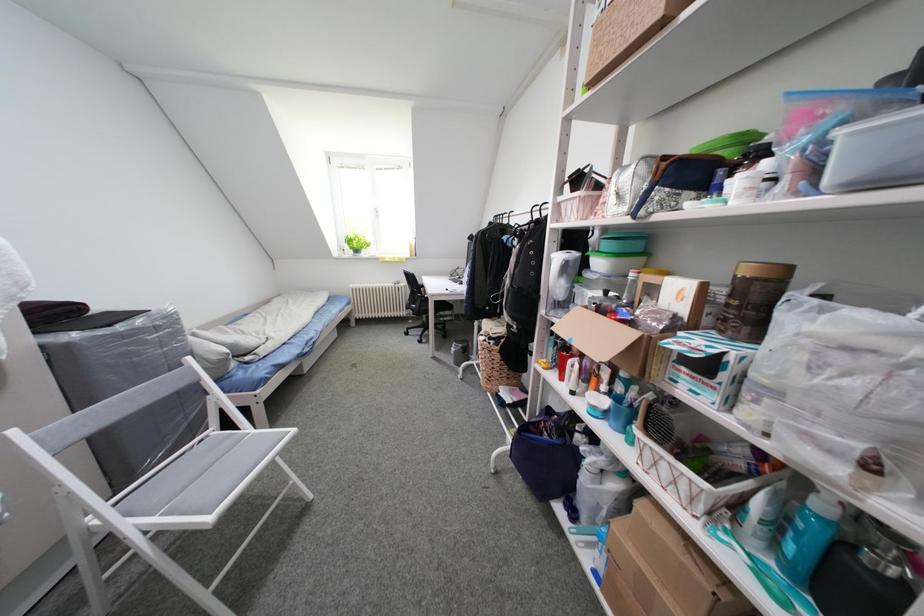
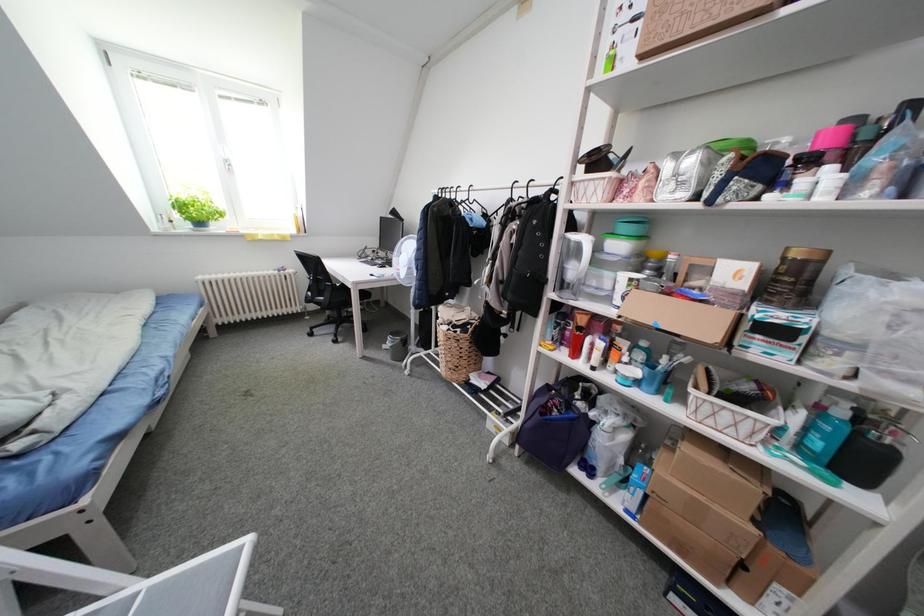
Question: The images are taken continuously from a first-person perspective. In which direction is your viewpoint rotating?

Choices:
 (A) Left
 (B) Right
 (C) Up
 (D) Down

Answer: (B)